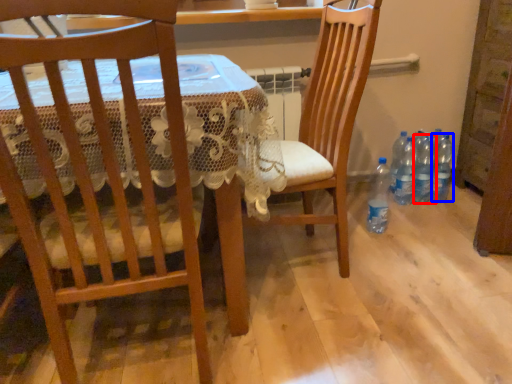
Question: Which object is closer to the camera taking this photo, bottle (highlighted by a red box) or bottle (highlighted by a blue box)?

Choices:
 (A) bottle
 (B) bottle

Answer: (A)